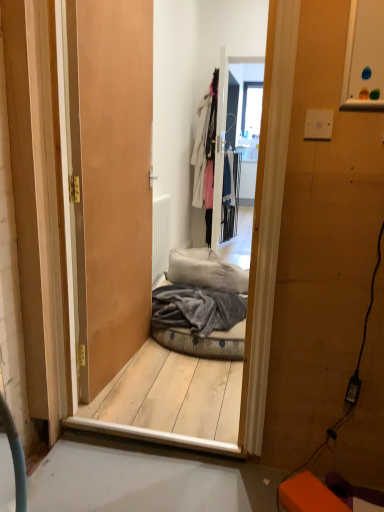
Question: Is wooden door at center positioned with its back to gray fleece blanket at center?

Choices:
 (A) no
 (B) yes

Answer: (A)

Question: Does wooden door at center lie behind gray fleece blanket at center?

Choices:
 (A) yes
 (B) no

Answer: (B)

Question: Can you confirm if wooden door at center is bigger than gray fleece blanket at center?

Choices:
 (A) no
 (B) yes

Answer: (B)

Question: Does wooden door at center have a greater height compared to gray fleece blanket at center?

Choices:
 (A) yes
 (B) no

Answer: (A)

Question: Are wooden door at center and gray fleece blanket at center far apart?

Choices:
 (A) yes
 (B) no

Answer: (B)

Question: Is wooden door at center smaller than gray fleece blanket at center?

Choices:
 (A) no
 (B) yes

Answer: (A)

Question: Are velvet grey pet bed at center and white cotton coat at upper center far apart?

Choices:
 (A) no
 (B) yes

Answer: (B)

Question: Is velvet grey pet bed at center oriented towards white cotton coat at upper center?

Choices:
 (A) yes
 (B) no

Answer: (B)

Question: Is the position of velvet grey pet bed at center more distant than that of white cotton coat at upper center?

Choices:
 (A) no
 (B) yes

Answer: (A)

Question: Considering the relative positions of velvet grey pet bed at center and white cotton coat at upper center in the image provided, is velvet grey pet bed at center to the left of white cotton coat at upper center from the viewer's perspective?

Choices:
 (A) no
 (B) yes

Answer: (B)

Question: From a real-world perspective, is velvet grey pet bed at center on white cotton coat at upper center?

Choices:
 (A) no
 (B) yes

Answer: (A)

Question: Can you confirm if velvet grey pet bed at center is thinner than white cotton coat at upper center?

Choices:
 (A) no
 (B) yes

Answer: (A)

Question: Is the depth of white cotton coat at upper center greater than that of transparent glass window at upper center?

Choices:
 (A) no
 (B) yes

Answer: (A)